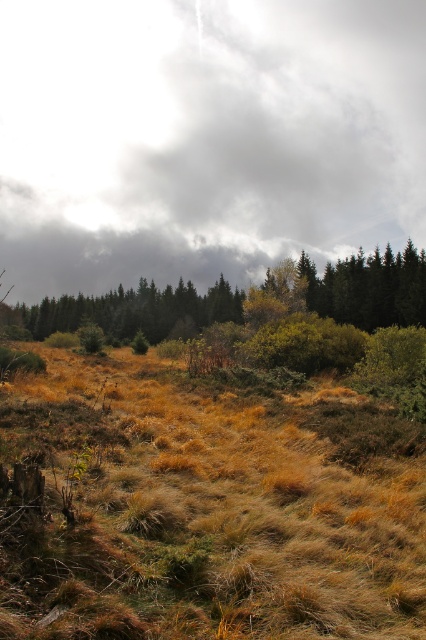
Question: Which of the following is the closest to the observer?

Choices:
 (A) (62, 156)
 (B) (131, 392)

Answer: (B)

Question: Based on their relative distances, which object is farther from the dry grass at center?

Choices:
 (A) green matte tree at center
 (B) cloudy sky at upper center

Answer: (B)

Question: Is dry grass at center bigger than green matte tree at center?

Choices:
 (A) no
 (B) yes

Answer: (A)

Question: Considering the relative positions of dry grass at center and green matte tree at center in the image provided, where is dry grass at center located with respect to green matte tree at center?

Choices:
 (A) right
 (B) left

Answer: (A)

Question: Is dry grass at center below green matte tree at center?

Choices:
 (A) no
 (B) yes

Answer: (B)

Question: Which point appears closest to the camera in this image?

Choices:
 (A) (198, 259)
 (B) (216, 561)

Answer: (B)